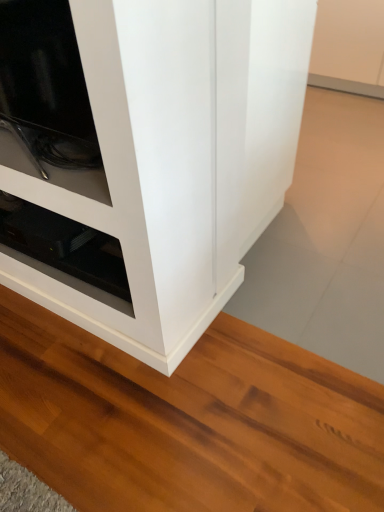
Identify the location of black glossy shelf at lower left. Image resolution: width=384 pixels, height=512 pixels. (65, 251).

Describe the element at coordinates (65, 251) in the screenshot. I see `black glossy shelf at lower left` at that location.

Image resolution: width=384 pixels, height=512 pixels. What do you see at coordinates (145, 156) in the screenshot?
I see `white glossy cupboard at center` at bounding box center [145, 156].

The image size is (384, 512). Find the location of `white glossy cupboard at center`. white glossy cupboard at center is located at coordinates (145, 156).

Locate an element on the screen. The height and width of the screenshot is (512, 384). black glossy shelf at lower left is located at coordinates (65, 251).

Between black glossy shelf at lower left and white glossy cupboard at center, which one appears on the right side from the viewer's perspective?

From the viewer's perspective, white glossy cupboard at center appears more on the right side.

Is black glossy shelf at lower left positioned behind white glossy cupboard at center?

Yes, black glossy shelf at lower left is behind white glossy cupboard at center.

Which is behind, point (121, 274) or point (3, 203)?

Positioned behind is point (3, 203).

From the image's perspective, is black glossy shelf at lower left under white glossy cupboard at center?

Yes.

Based on the photo, from a real-world perspective, is black glossy shelf at lower left positioned under white glossy cupboard at center based on gravity?

No, from a real-world perspective, black glossy shelf at lower left is not under white glossy cupboard at center.

Is black glossy shelf at lower left thinner than white glossy cupboard at center?

Correct, the width of black glossy shelf at lower left is less than that of white glossy cupboard at center.

Is black glossy shelf at lower left shorter than white glossy cupboard at center?

Yes.

Consider the image. Between black glossy shelf at lower left and white glossy cupboard at center, which one has smaller size?

With smaller size is black glossy shelf at lower left.

Is black glossy shelf at lower left inside the boundaries of white glossy cupboard at center, or outside?

black glossy shelf at lower left is not inside white glossy cupboard at center, it's outside.

Can you see black glossy shelf at lower left touching white glossy cupboard at center?

No, black glossy shelf at lower left is not in contact with white glossy cupboard at center.

From the picture: Is black glossy shelf at lower left positioned with its back to white glossy cupboard at center?

black glossy shelf at lower left does not have its back to white glossy cupboard at center.

Can you tell me how much black glossy shelf at lower left and white glossy cupboard at center differ in facing direction?

They differ by 91.6 degrees in their facing directions.

Measure the distance between black glossy shelf at lower left and white glossy cupboard at center.

They are 11.63 inches apart.

Locate an element on the screen. Image resolution: width=384 pixels, height=512 pixels. shelf above the white glossy cupboard at center (from a real-world perspective) is located at coordinates (65, 251).

Is white glossy cupboard at center to the left or to the right of black glossy shelf at lower left in the image?

In the image, white glossy cupboard at center appears on the right side of black glossy shelf at lower left.

Consider the image. Which is behind, white glossy cupboard at center or black glossy shelf at lower left?

black glossy shelf at lower left.

Is point (161, 218) positioned behind point (106, 293)?

That is False.

From the image's perspective, does white glossy cupboard at center appear higher than black glossy shelf at lower left?

Indeed, from the image's perspective, white glossy cupboard at center is shown above black glossy shelf at lower left.

From a real-world perspective, which is physically above, white glossy cupboard at center or black glossy shelf at lower left?

From a 3D spatial view, black glossy shelf at lower left is above.

Between white glossy cupboard at center and black glossy shelf at lower left, which one has smaller width?

black glossy shelf at lower left is thinner.

Which of these two, white glossy cupboard at center or black glossy shelf at lower left, stands shorter?

black glossy shelf at lower left is shorter.

From the picture: Looking at the image, does white glossy cupboard at center seem bigger or smaller compared to black glossy shelf at lower left?

white glossy cupboard at center is bigger than black glossy shelf at lower left.

Can black glossy shelf at lower left be found inside white glossy cupboard at center?

No, black glossy shelf at lower left is not inside white glossy cupboard at center.

Is white glossy cupboard at center touching black glossy shelf at lower left?

No, white glossy cupboard at center is not beside black glossy shelf at lower left.

Is white glossy cupboard at center facing away from black glossy shelf at lower left?

No, white glossy cupboard at center's orientation is not away from black glossy shelf at lower left.

How different are the orientations of white glossy cupboard at center and black glossy shelf at lower left in degrees?

The angle between the facing direction of white glossy cupboard at center and the facing direction of black glossy shelf at lower left is 91.6 degrees.

Identify the location of cupboard above the black glossy shelf at lower left (from the image's perspective). (145, 156).

In the image, there is a black glossy shelf at lower left. Find the location of `cupboard above it (from the image's perspective)`. cupboard above it (from the image's perspective) is located at coordinates (145, 156).

The height and width of the screenshot is (512, 384). I want to click on cupboard located in front of the black glossy shelf at lower left, so click(145, 156).